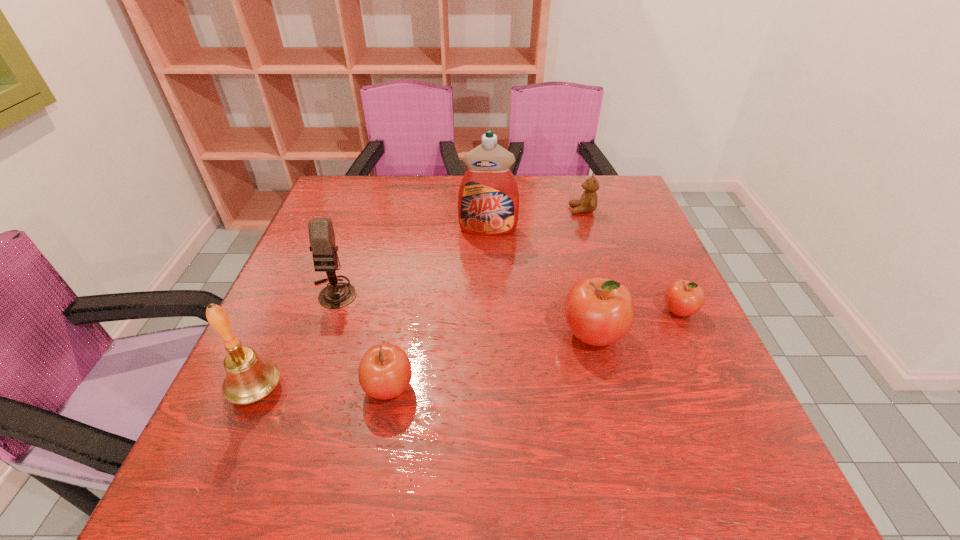
Where is `apple present at the near edge`? apple present at the near edge is located at coordinates (385, 372).

Identify the location of bell that is at the near edge. (250, 378).

Identify the location of microphone present at the left edge. (324, 250).

This screenshot has height=540, width=960. What are the coordinates of `bell located at the left edge` in the screenshot? It's located at (250, 378).

What are the coordinates of `teddy bear that is at the right edge` in the screenshot? It's located at (588, 203).

Find the location of `object positioned at the near left corner`. object positioned at the near left corner is located at coordinates (250, 378).

You are a GUI agent. You are given a task and a screenshot of the screen. Output one action in this format:
    pyautogui.click(x=<x>, y=<y>)
    Task: Click on the object that is at the far right corner
    
    Given the screenshot: What is the action you would take?
    pyautogui.click(x=588, y=203)

Find the location of a particular element. Image resolution: width=960 pixels, height=540 pixels. free region at the far edge is located at coordinates (386, 195).

Locate an element on the screen. The height and width of the screenshot is (540, 960). vacant area at the near edge is located at coordinates (425, 433).

Identify the location of vacant space at the left edge. (308, 353).